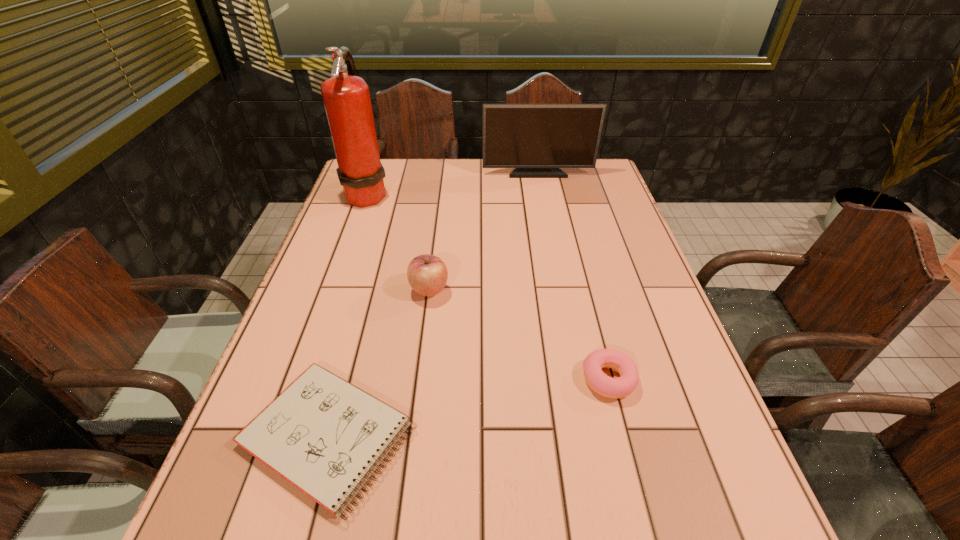
I want to click on free space located 0.230m on the right of the third tallest object, so click(542, 290).

Where is `free space located 0.070m on the front of the doughnut`? Image resolution: width=960 pixels, height=540 pixels. free space located 0.070m on the front of the doughnut is located at coordinates (623, 437).

You are a GUI agent. You are given a task and a screenshot of the screen. Output one action in this format:
    pyautogui.click(x=<x>, y=<y>)
    Task: Click on the free location located on the back of the notepad
    
    Given the screenshot: What is the action you would take?
    pyautogui.click(x=364, y=306)

Where is `fire extinguisher positioned at the far edge`? fire extinguisher positioned at the far edge is located at coordinates 346,97.

Locate an element on the screen. The image size is (960, 540). monitor that is positioned at the far edge is located at coordinates (537, 140).

Where is `object present at the near edge`? object present at the near edge is located at coordinates (324, 435).

Where is `fire extinguisher that is at the left edge`? fire extinguisher that is at the left edge is located at coordinates (346, 97).

Identify the location of notepad that is at the left edge. The image size is (960, 540). coord(324,435).

This screenshot has height=540, width=960. I want to click on monitor at the right edge, so click(537, 140).

The width and height of the screenshot is (960, 540). I want to click on doughnut at the right edge, so click(598, 381).